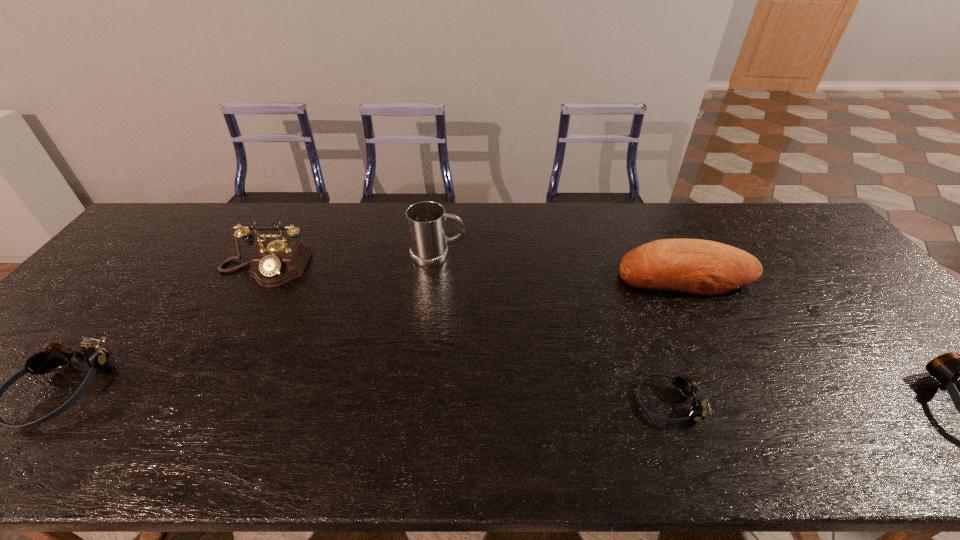
Locate an element on the screen. The height and width of the screenshot is (540, 960). vacant space positioned 0.400m on the dial of the telephone is located at coordinates (184, 414).

This screenshot has height=540, width=960. Identify the location of object that is at the far edge. (426, 223).

This screenshot has height=540, width=960. I want to click on object that is positioned at the near edge, so click(x=687, y=387).

This screenshot has width=960, height=540. What are the coordinates of `vacant space at the far edge` in the screenshot? It's located at (756, 224).

Locate an element on the screen. The width and height of the screenshot is (960, 540). vacant region at the near edge of the desktop is located at coordinates (323, 401).

In order to click on vacant space at the left edge in this screenshot , I will do `click(135, 273)`.

Locate an element on the screen. This screenshot has width=960, height=540. vacant area at the right edge is located at coordinates (900, 372).

The height and width of the screenshot is (540, 960). Identify the location of vacant space at the far right corner. (782, 208).

Identify the location of free space between the second goggles from right to left and the fourth shortest object. Image resolution: width=960 pixels, height=540 pixels. (677, 339).

Locate an element on the screen. This screenshot has height=540, width=960. free space that is in between the fourth object from right to left and the telephone is located at coordinates 351,262.